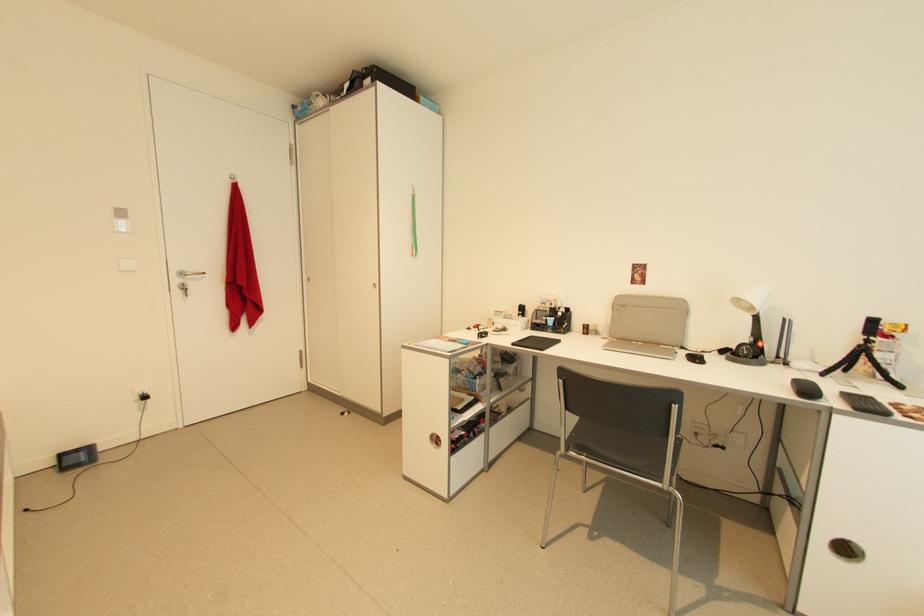
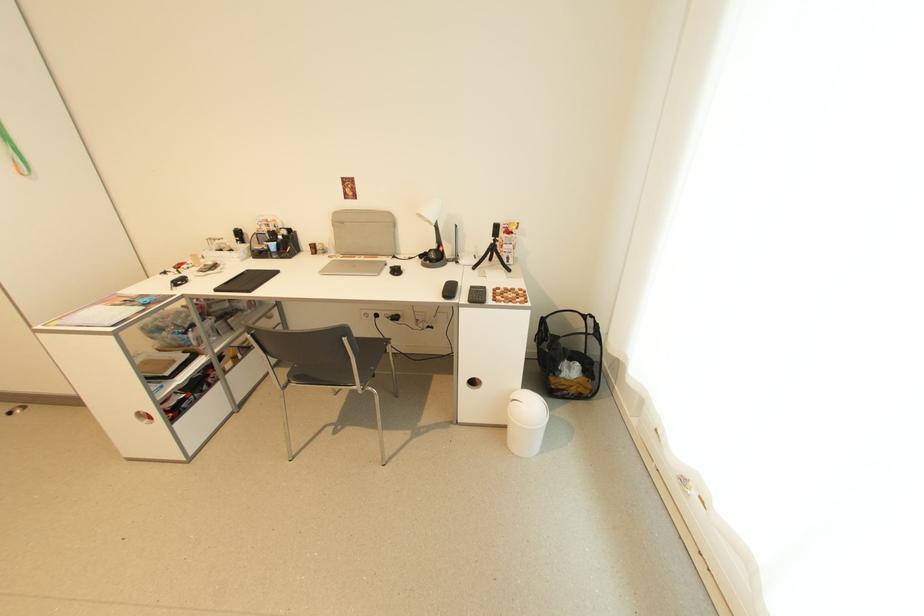
In the second image, find the point that corresponds to pixel 860 411 in the first image.

(473, 302)